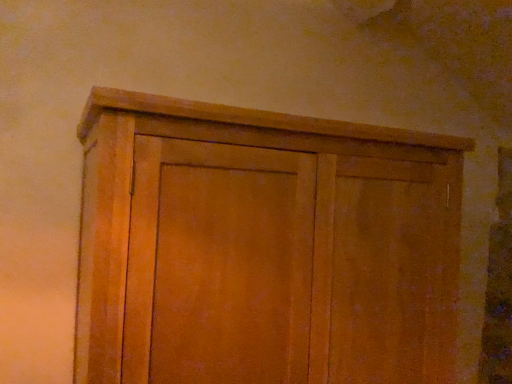
The width and height of the screenshot is (512, 384). Identify the location of wooden cupboard at upper center. (263, 247).

What do you see at coordinates (263, 247) in the screenshot?
I see `wooden cupboard at upper center` at bounding box center [263, 247].

You are a GUI agent. You are given a task and a screenshot of the screen. Output one action in this format:
    pyautogui.click(x=<x>, y=<y>)
    Task: Click on the wooden cupboard at upper center
    The width and height of the screenshot is (512, 384).
    Given the screenshot: What is the action you would take?
    pyautogui.click(x=263, y=247)